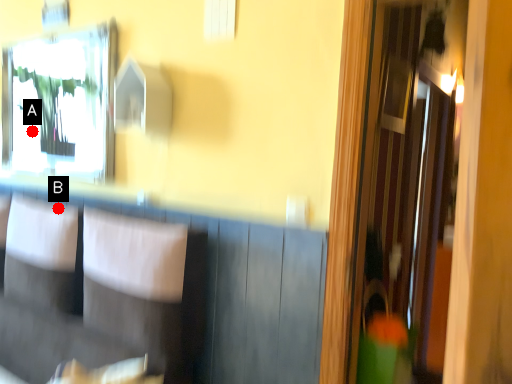
Question: Two points are circled on the image, labeled by A and B beside each circle. Among these points, which one is farthest from the camera?

Choices:
 (A) A is further
 (B) B is further

Answer: (A)